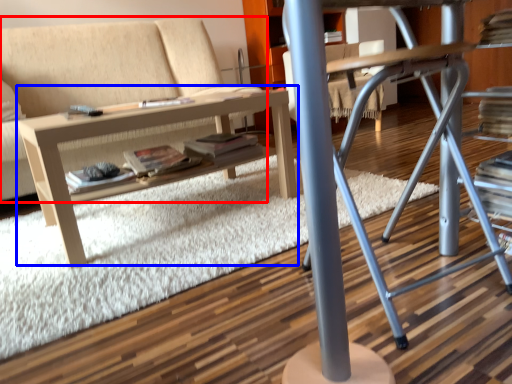
Question: Which of the following is the closest to the observer, studio couch (highlighted by a red box) or table (highlighted by a blue box)?

Choices:
 (A) studio couch
 (B) table

Answer: (B)